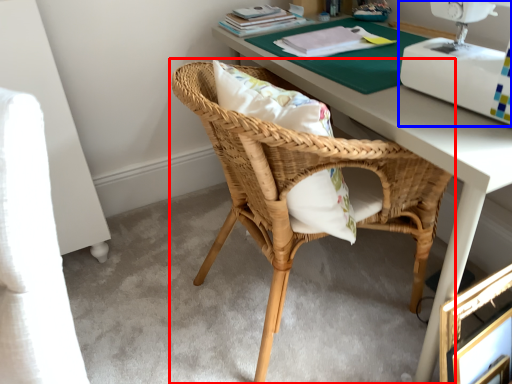
Question: Which object is closer to the camera taking this photo, chair (highlighted by a red box) or sewing machine (highlighted by a blue box)?

Choices:
 (A) chair
 (B) sewing machine

Answer: (B)